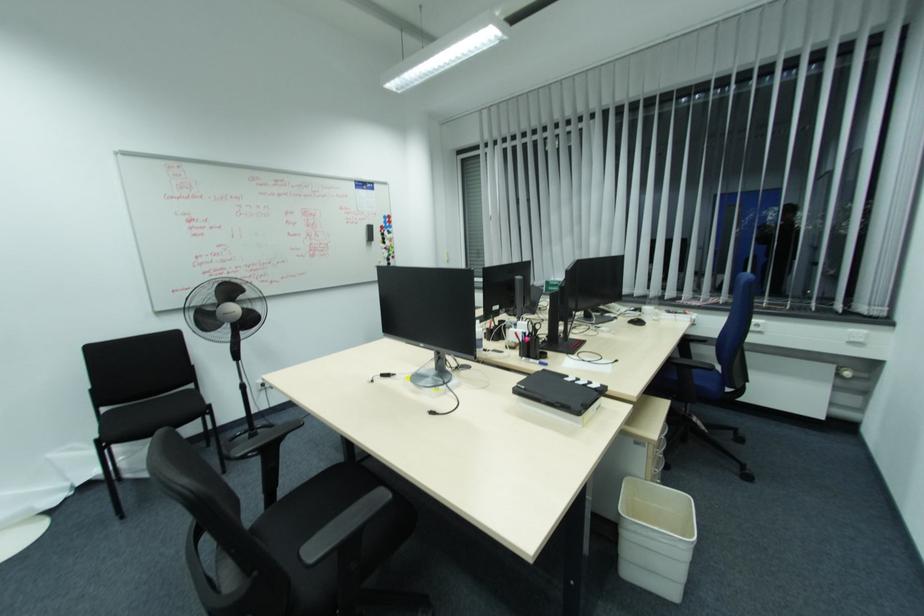
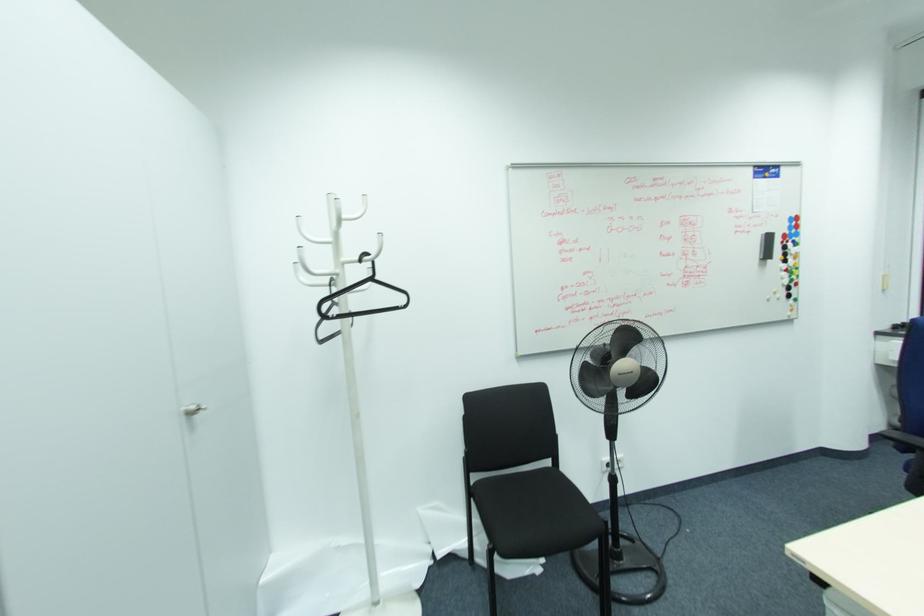
Where in the second image is the point corresponding to point 390,229 from the first image?

(796, 238)